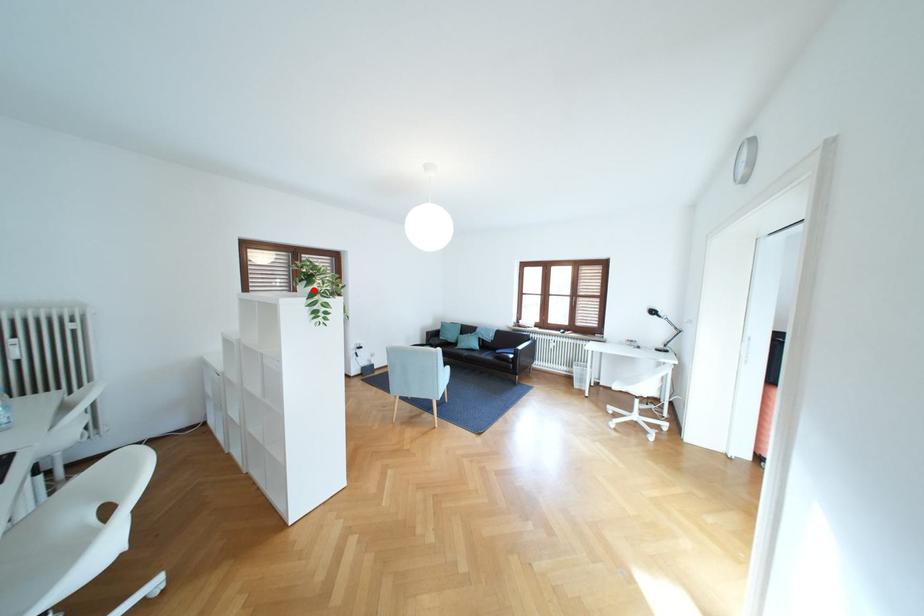
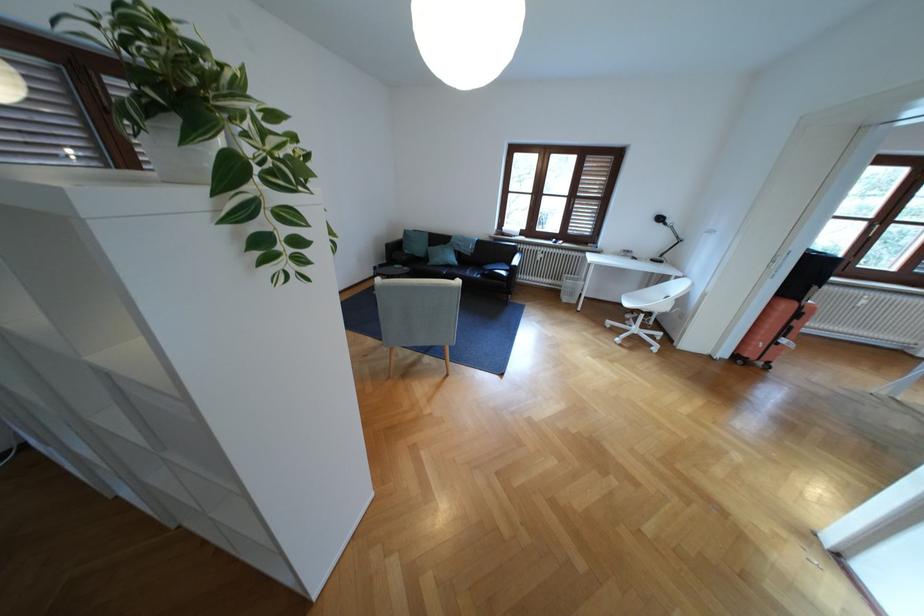
Find the pixel in the second image that matches the highlighted location in the first image.

(187, 155)